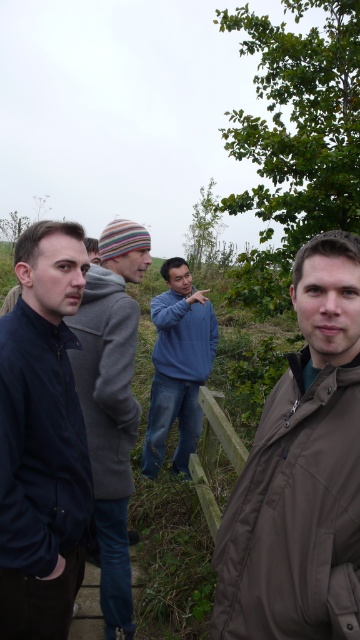
You are a photographer trying to capture a group photo of the brown matte jacket at lower right and the blue cotton sweater at center. Since you want both subjects to be clearly visible, which person should you focus on to ensure they take up more of the frame?

The blue cotton sweater at center occupies more space in the frame than the brown matte jacket at lower right, so focusing on the blue cotton sweater at center would ensure it takes up more of the frame.